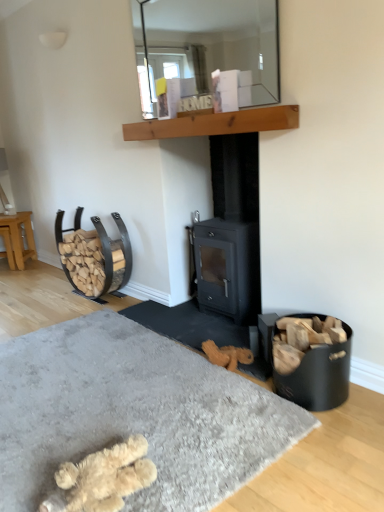
The image size is (384, 512). I want to click on vacant region under wooden at upper center (from a real-world perspective), so click(204, 316).